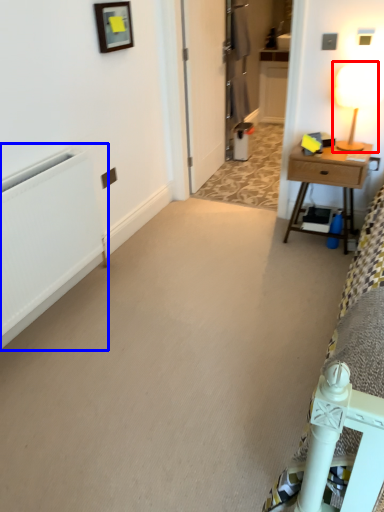
Question: Which point is closer to the camera, table lamp (highlighted by a red box) or radiator (highlighted by a blue box)?

Choices:
 (A) table lamp
 (B) radiator

Answer: (B)